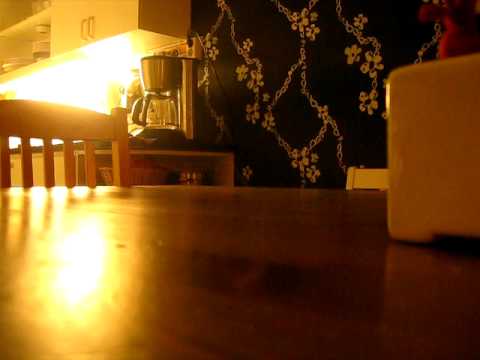
Where is `handles`? The image size is (480, 360). handles is located at coordinates (91, 21).